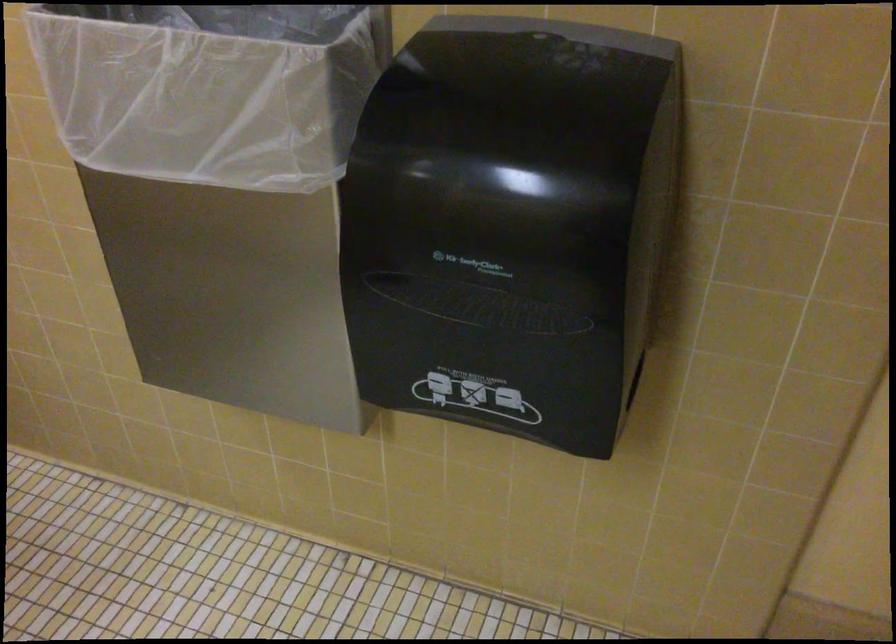
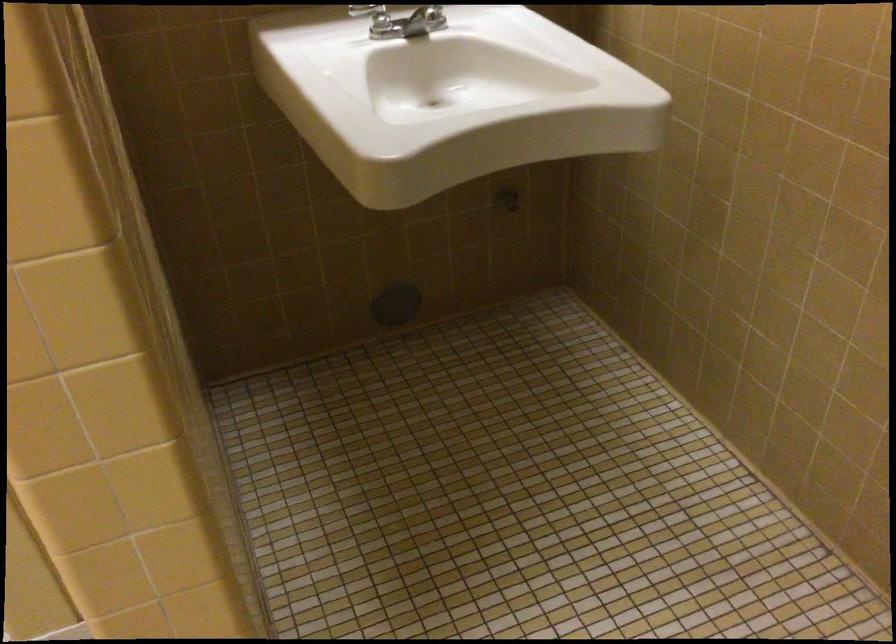
Question: Based on the continuous images, in which direction is the camera rotating? Reply with the corresponding letter.

Choices:
 (A) Left
 (B) Right
 (C) Up
 (D) Down

Answer: (A)